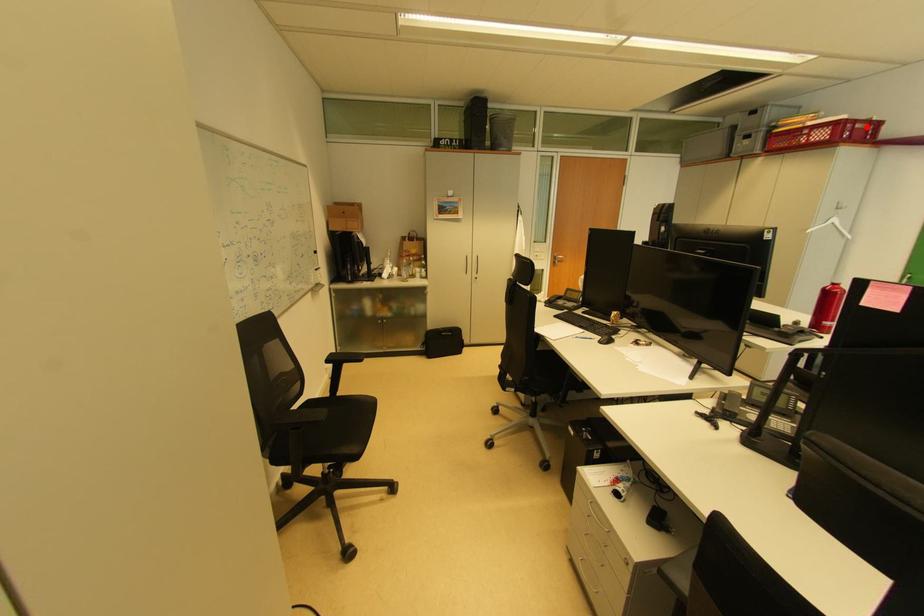
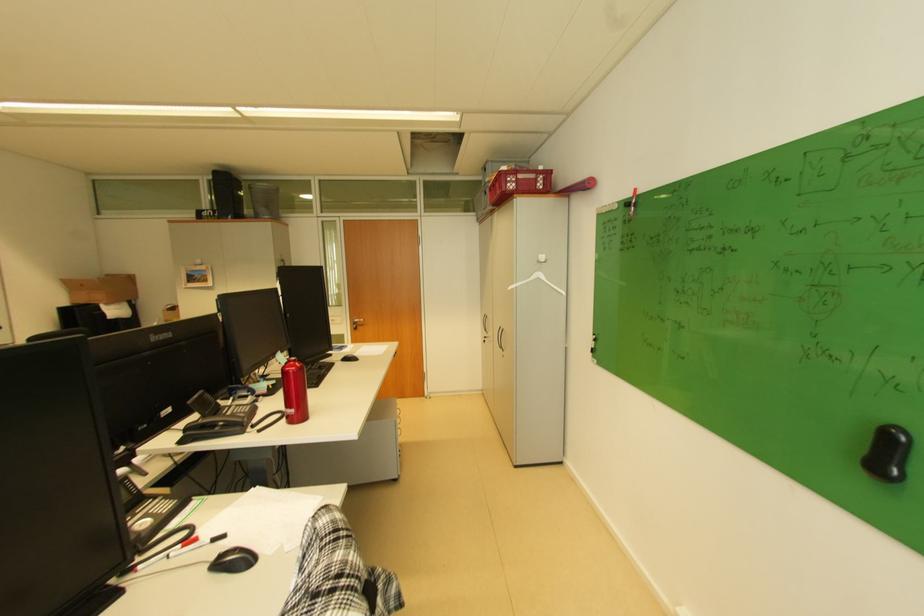
In the second image, find the point that corresponds to the highlighted location in the first image.

(529, 177)